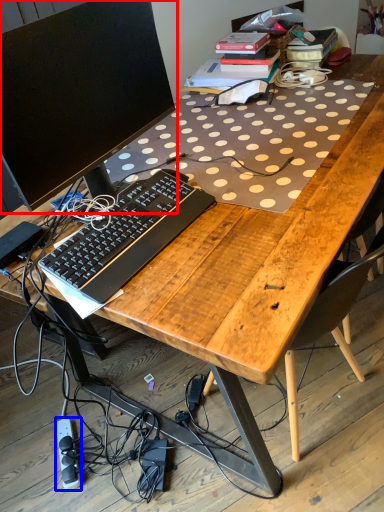
Question: Which of the following is the farthest to the observer, computer monitor (highlighted by a red box) or equipment (highlighted by a blue box)?

Choices:
 (A) computer monitor
 (B) equipment

Answer: (B)